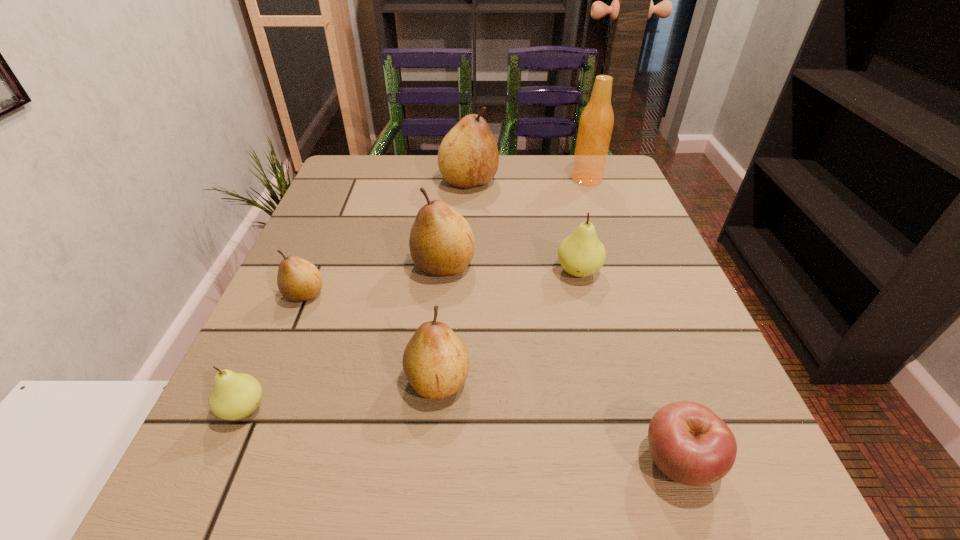
Image resolution: width=960 pixels, height=540 pixels. What are the coordinates of `free space between the tallest object and the nearer green pear` in the screenshot? It's located at (x=415, y=294).

You are a GUI agent. You are given a task and a screenshot of the screen. Output one action in this format:
    pyautogui.click(x=<x>, y=<y>)
    Task: Click on the vacant space that is in between the farthest pear and the left green pear
    Image resolution: width=960 pixels, height=540 pixels.
    Given the screenshot: What is the action you would take?
    pyautogui.click(x=356, y=295)

Where is `free space between the beer bottle and the shortest object`? The height and width of the screenshot is (540, 960). free space between the beer bottle and the shortest object is located at coordinates (633, 320).

The height and width of the screenshot is (540, 960). In order to click on empty space between the leftmost brown pear and the bigger green pear in this screenshot , I will do `click(442, 283)`.

I want to click on free point between the second tallest object and the leftmost brown pear, so click(387, 238).

The width and height of the screenshot is (960, 540). In order to click on the fifth closest object to the leftmost brown pear in this screenshot , I will do `click(581, 254)`.

In order to click on the seventh closest object to the nearest brown pear in this screenshot , I will do `click(596, 123)`.

This screenshot has height=540, width=960. Identify the location of pear that can be found as the second closest to the sixth shortest object. (581, 254).

This screenshot has height=540, width=960. I want to click on pear that is the third closest to the third smallest brown pear, so click(x=436, y=363).

Locate which brown pear is the closest to the third tallest object. Please provide its 2D coordinates. Your answer should be formatted as a tuple, i.e. [(x, y)], where the tuple contains the x and y coordinates of a point satisfying the conditions above.

[(298, 280)]